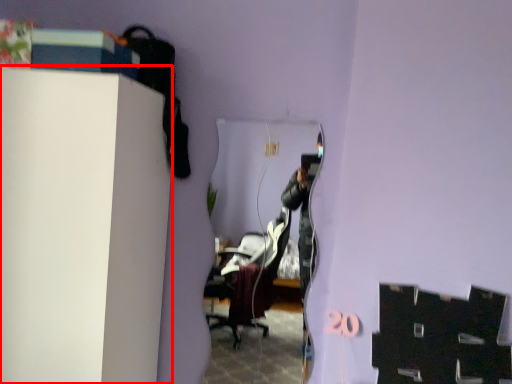
Question: From the image's perspective, what is the correct spatial relationship of furniture (annotated by the red box) in relation to mirror?

Choices:
 (A) above
 (B) below

Answer: (A)